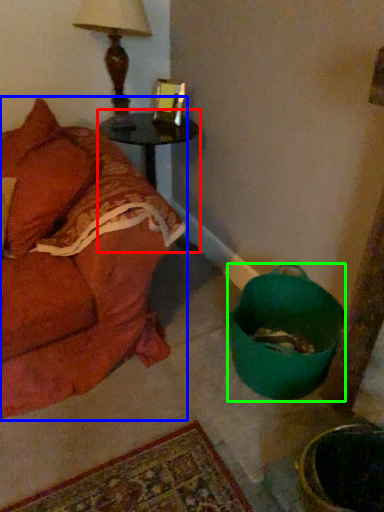
Question: Based on their relative distances, which object is farther from table (highlighted by a red box)? Choose from studio couch (highlighted by a blue box) and mixing bowl (highlighted by a green box).

Choices:
 (A) studio couch
 (B) mixing bowl

Answer: (B)